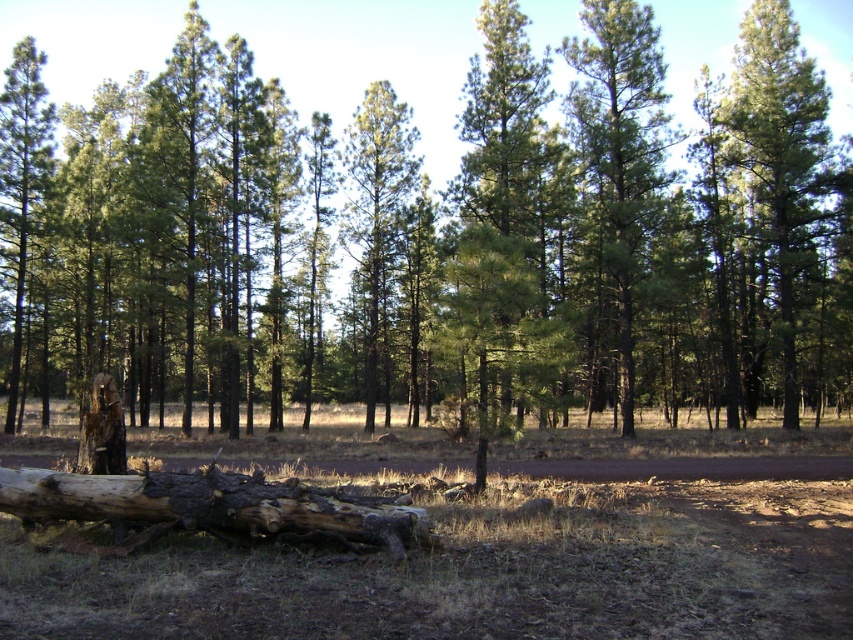
Which is more to the right, green matte tree at center or green matte tree at upper right?

green matte tree at upper right

Does green matte tree at center have a lesser height compared to green matte tree at upper right?

In fact, green matte tree at center may be taller than green matte tree at upper right.

Does point (256, 154) come in front of point (827, 150)?

That is True.

The width and height of the screenshot is (853, 640). Identify the location of green matte tree at center. (434, 237).

How far apart are green matte tree at upper right and charred wood stump at lower left?

26.42 meters

Between green matte tree at upper right and charred wood stump at lower left, which one has less height?

charred wood stump at lower left is shorter.

Does point (786, 156) come behind point (91, 429)?

Yes, point (786, 156) is farther from viewer.

Locate an element on the screen. Image resolution: width=853 pixels, height=640 pixels. green matte tree at upper right is located at coordinates (780, 157).

Which is in front, point (24, 49) or point (369, 161)?

Positioned in front is point (24, 49).

Is green matte tree at center to the right of green needle-like tree at center from the viewer's perspective?

No, green matte tree at center is not to the right of green needle-like tree at center.

The image size is (853, 640). What do you see at coordinates (434, 237) in the screenshot?
I see `green matte tree at center` at bounding box center [434, 237].

Where is `green matte tree at center`? green matte tree at center is located at coordinates (434, 237).